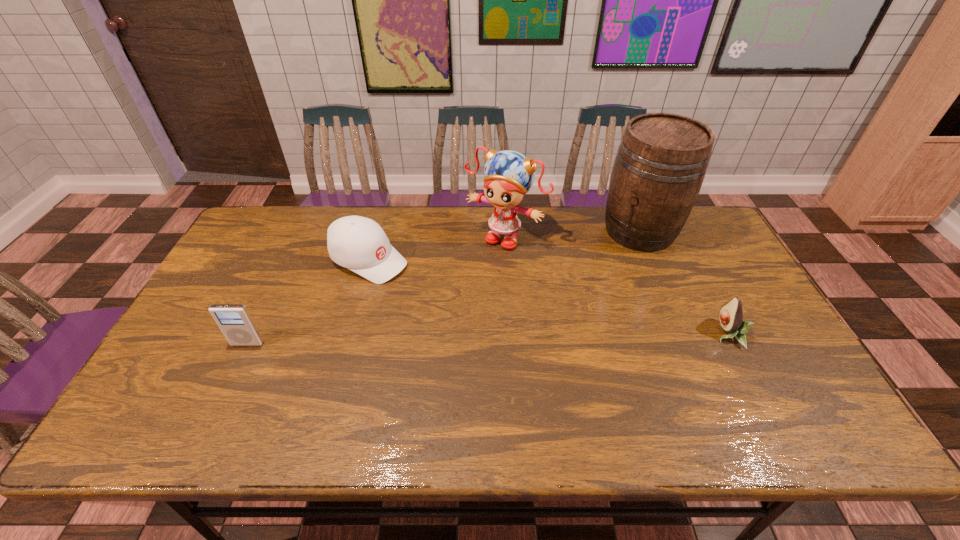
Identify the location of vacant area located on the face of the fourth shortest object. (448, 302).

This screenshot has width=960, height=540. Find the location of `free region located on the face of the fourth shortest object`. free region located on the face of the fourth shortest object is located at coordinates (473, 270).

This screenshot has width=960, height=540. I want to click on vacant region located 0.220m on the face of the fourth shortest object, so click(454, 295).

This screenshot has width=960, height=540. I want to click on vacant space situated 0.290m on the side of the tallest object near the bung hole, so click(572, 300).

The height and width of the screenshot is (540, 960). What are the coordinates of `free space located on the side of the tallest object near the bung hole` in the screenshot? It's located at (587, 285).

The width and height of the screenshot is (960, 540). In order to click on free space located on the side of the tallest object near the bung hole in this screenshot , I will do `click(553, 320)`.

This screenshot has width=960, height=540. Find the location of `free space located 0.100m on the front-facing side of the baseball cap`. free space located 0.100m on the front-facing side of the baseball cap is located at coordinates (424, 286).

Identify the location of free space located 0.250m on the front-facing side of the baseball cap. This screenshot has height=540, width=960. (467, 307).

The width and height of the screenshot is (960, 540). In order to click on vacant space located on the front-facing side of the baseball cap in this screenshot , I will do `click(417, 282)`.

Where is `doll at the far edge`? This screenshot has width=960, height=540. doll at the far edge is located at coordinates (509, 175).